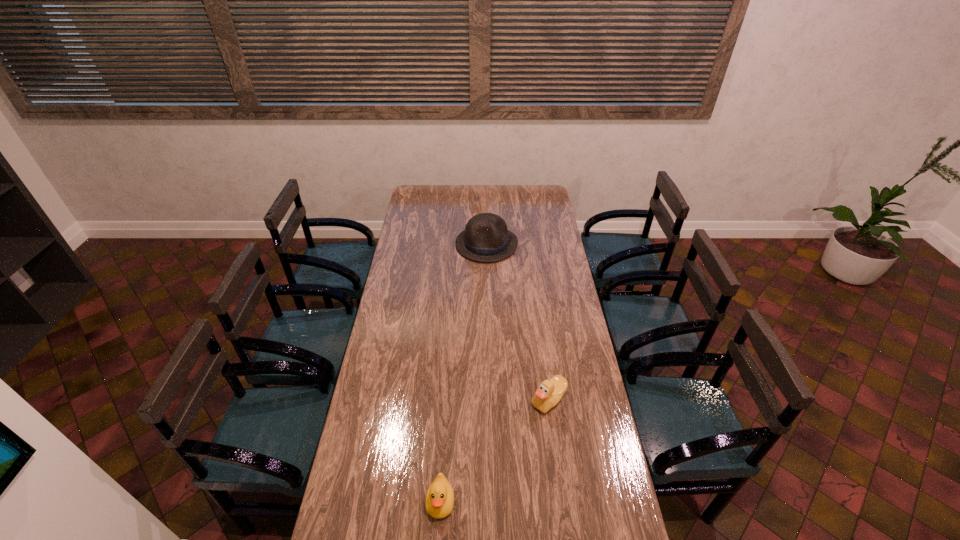
Point out which object is positioned as the nearest to the left duck. Please provide its 2D coordinates. Your answer should be formatted as a tuple, i.e. [(x, y)], where the tuple contains the x and y coordinates of a point satisfying the conditions above.

[(548, 394)]

The image size is (960, 540). I want to click on vacant space that satisfies the following two spatial constraints: 1. at the beak of the farther duck; 2. at the beak of the left duck, so click(563, 502).

Locate an element on the screen. This screenshot has width=960, height=540. vacant area in the image that satisfies the following two spatial constraints: 1. at the beak of the right duck; 2. at the beak of the nearer duck is located at coordinates (563, 502).

I want to click on free space that satisfies the following two spatial constraints: 1. at the beak of the right duck; 2. at the beak of the left duck, so click(x=563, y=502).